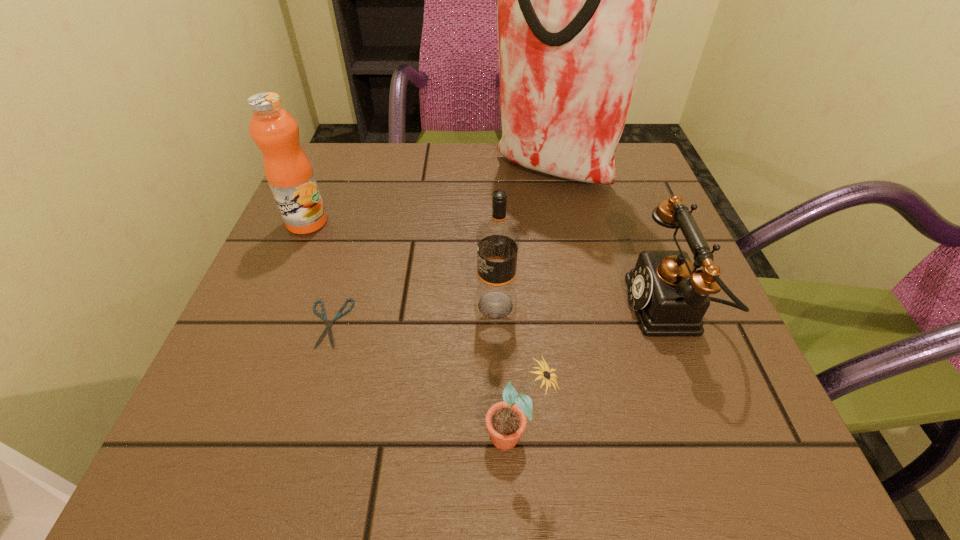
You are a GUI agent. You are given a task and a screenshot of the screen. Output one action in this format:
    pyautogui.click(x=<x>, y=<y>)
    Task: Click on the free spot located 0.080m on the front of the fifth nearest object
    This screenshot has height=540, width=960.
    Given the screenshot: What is the action you would take?
    pyautogui.click(x=289, y=264)

This screenshot has height=540, width=960. I want to click on vacant space located on the label of the vodka, so click(x=352, y=306).

Find the location of a particular element. The height and width of the screenshot is (540, 960). vacant area situated on the label of the vodka is located at coordinates (404, 306).

In order to click on free space located on the label of the vodka in this screenshot , I will do `click(300, 306)`.

You are a GUI agent. You are given a task and a screenshot of the screen. Output one action in this format:
    pyautogui.click(x=<x>, y=<y>)
    Task: Click on the free space located on the front of the telephone at the rotary dial
    The width and height of the screenshot is (960, 540).
    Given the screenshot: What is the action you would take?
    pyautogui.click(x=546, y=308)

Locate an element on the screen. The height and width of the screenshot is (540, 960). vacant region located on the front of the telephone at the rotary dial is located at coordinates (488, 308).

I want to click on vacant space located on the front of the telephone at the rotary dial, so coord(429,308).

Image resolution: width=960 pixels, height=540 pixels. What are the coordinates of `vacant space located 0.280m on the flower of the nearest object` in the screenshot? It's located at (278, 435).

Find the location of a particular element. free space located on the flower of the nearest object is located at coordinates (426, 435).

Find the location of a particular element. vacant space situated 0.150m on the flower of the nearest object is located at coordinates (374, 435).